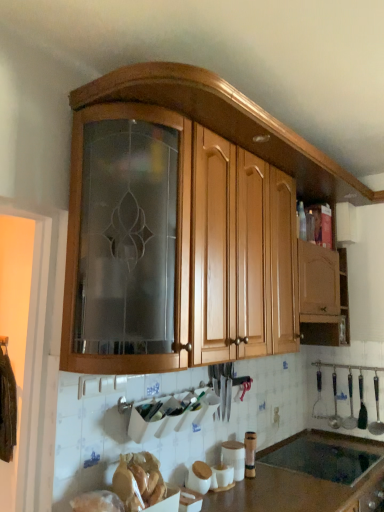
Question: In the image, is wooden cabinet at upper center positioned in front of or behind white matte canister at lower center, positioned as the 1th appliance in front-to-back order?

Choices:
 (A) behind
 (B) front

Answer: (B)

Question: Is wooden cabinet at upper center spatially inside white matte canister at lower center, the second appliance positioned from the back, or outside of it?

Choices:
 (A) inside
 (B) outside

Answer: (B)

Question: Which object is the farthest from the white glossy canister at lower center, the 1th appliance from the right?

Choices:
 (A) metallic silver spoon at lower right, marked as the 1th silverware in a left-to-right arrangement
 (B) black matte sink at lower center
 (C) polished metal ladle at right, positioned as the first silverware in right-to-left order
 (D) brown laminate countertop at lower center
 (E) white matte canister at lower center, the second appliance positioned from the back

Answer: (C)

Question: Considering the real-world distances, which object is closest to the wooden cabinet at upper center?

Choices:
 (A) black matte sink at lower center
 (B) metallic silver spoon at lower right, marked as the 1th silverware in a left-to-right arrangement
 (C) white matte screen door at left
 (D) white glossy canister at lower center, placed as the second appliance when sorted from left to right
 (E) white matte canister at lower center, the second appliance positioned from the back

Answer: (C)